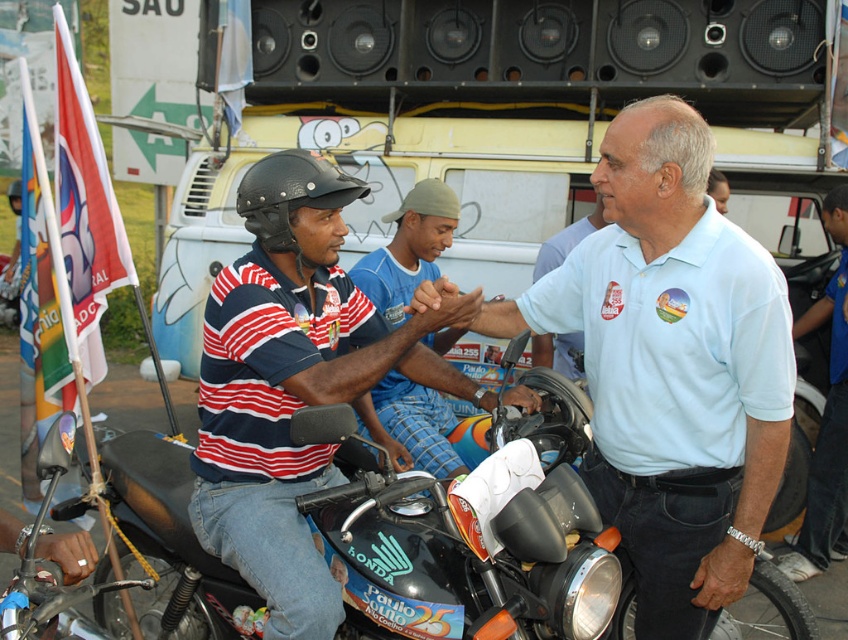
Based on the scene description, where is the white cotton shirt at center located in the image?

The white cotton shirt at center is located at point 0.656 on the x axis and 0.975 on the y axis.

You are a photographer at the event and want to capture both the white cotton shirt at center and the light blue polo shirt at center in a single photo. Which shirt should you focus on first to ensure both are in frame?

You should focus on the white cotton shirt at center first because it is closer to the camera than the light blue polo shirt at center, so by focusing on it, the light blue polo shirt at center will also be in focus as it is behind.